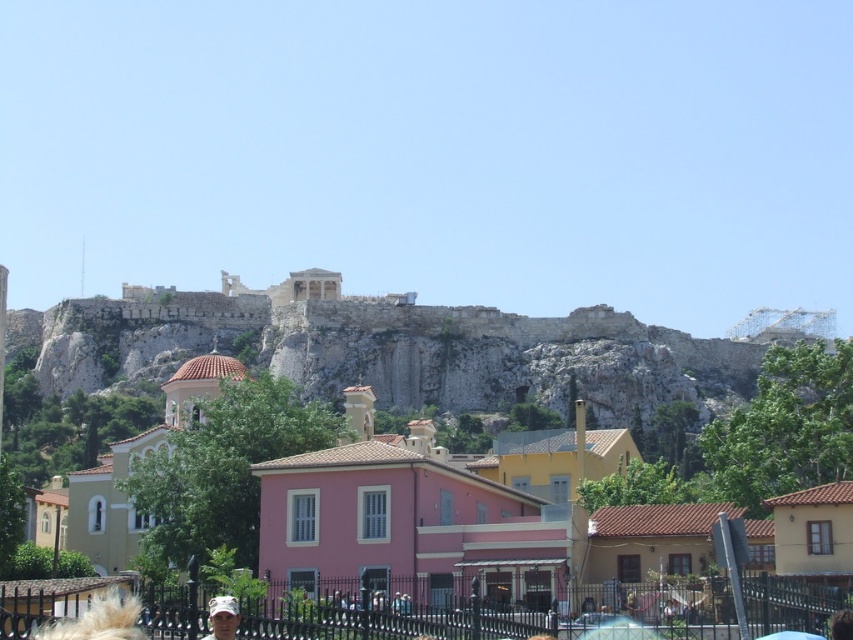
Is pink matte building at center further to camera compared to camouflage fabric cap at lower center?

No, pink matte building at center is in front of camouflage fabric cap at lower center.

Between pink matte building at center and camouflage fabric cap at lower center, which one has more height?

With more height is pink matte building at center.

You are a GUI agent. You are given a task and a screenshot of the screen. Output one action in this format:
    pyautogui.click(x=<x>, y=<y>)
    Task: Click on the pink matte building at center
    
    Given the screenshot: What is the action you would take?
    pyautogui.click(x=408, y=536)

Where is `pink matte building at center`? pink matte building at center is located at coordinates (408, 536).